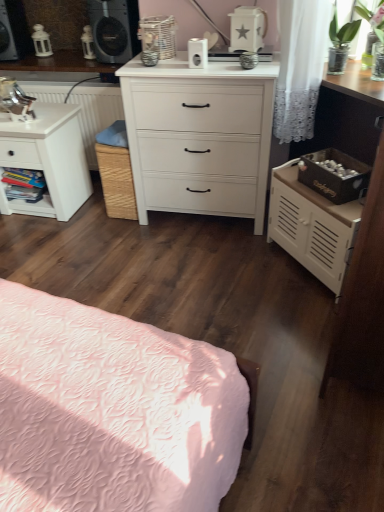
Question: Is white matte nightstand at left, the 1th nightstand in the left-to-right sequence, taller or shorter than matte black speaker at upper left, which is the 2th speaker from right to left?

Choices:
 (A) short
 (B) tall

Answer: (B)

Question: From the image's perspective, is white matte nightstand at left, the 2th nightstand positioned from the right, above or below matte black speaker at upper left, the 1th speaker from the left?

Choices:
 (A) below
 (B) above

Answer: (A)

Question: Which object is positioned closest to the white matte cabinet at right, the first nightstand in the right-to-left sequence?

Choices:
 (A) white matte chest of drawers at center
 (B) matte black speaker at upper center, which is counted as the 2th speaker, starting from the left
 (C) wooden bookshelf at left
 (D) white matte nightstand at left, the 2th nightstand positioned from the right
 (E) matte black speaker at upper left, which is the 2th speaker from right to left

Answer: (A)

Question: Estimate the real-world distances between objects in this image. Which object is closer to the wooden bookshelf at left?

Choices:
 (A) matte black speaker at upper left, the 1th speaker from the left
 (B) white matte nightstand at left, the 1th nightstand in the left-to-right sequence
 (C) white matte cabinet at right, placed as the second nightstand when sorted from left to right
 (D) matte black speaker at upper center, which is counted as the 2th speaker, starting from the left
 (E) white matte chest of drawers at center

Answer: (B)